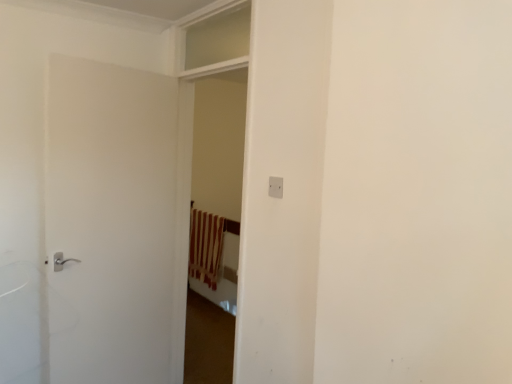
Question: Considering the relative sizes of white matte door at left and brown striped curtain at center in the image provided, is white matte door at left bigger than brown striped curtain at center?

Choices:
 (A) no
 (B) yes

Answer: (B)

Question: Is white matte door at left taller than brown striped curtain at center?

Choices:
 (A) yes
 (B) no

Answer: (A)

Question: Considering the relative positions of white matte door at left and brown striped curtain at center in the image provided, is white matte door at left to the left of brown striped curtain at center from the viewer's perspective?

Choices:
 (A) no
 (B) yes

Answer: (B)

Question: Does white matte door at left appear on the right side of brown striped curtain at center?

Choices:
 (A) no
 (B) yes

Answer: (A)

Question: Can you confirm if white matte door at left is thinner than brown striped curtain at center?

Choices:
 (A) no
 (B) yes

Answer: (B)

Question: In terms of height, does white plastic electric outlet at center look taller or shorter compared to brown striped curtain at center?

Choices:
 (A) short
 (B) tall

Answer: (A)

Question: Is white plastic electric outlet at center situated inside brown striped curtain at center or outside?

Choices:
 (A) inside
 (B) outside

Answer: (B)

Question: Is white plastic electric outlet at center wider or thinner than brown striped curtain at center?

Choices:
 (A) thin
 (B) wide

Answer: (A)

Question: Visually, is white plastic electric outlet at center positioned to the left or to the right of brown striped curtain at center?

Choices:
 (A) left
 (B) right

Answer: (B)

Question: Considering the positions of clear glass window at upper center and white matte door at left in the image, is clear glass window at upper center taller or shorter than white matte door at left?

Choices:
 (A) tall
 (B) short

Answer: (B)

Question: From the image's perspective, relative to white matte door at left, is clear glass window at upper center above or below?

Choices:
 (A) above
 (B) below

Answer: (A)

Question: From a real-world perspective, relative to white matte door at left, is clear glass window at upper center vertically above or below?

Choices:
 (A) above
 (B) below

Answer: (A)

Question: Is point (217, 16) closer or farther from the camera than point (155, 231)?

Choices:
 (A) closer
 (B) farther

Answer: (A)

Question: Does point (206, 258) appear closer or farther from the camera than point (205, 59)?

Choices:
 (A) farther
 (B) closer

Answer: (A)

Question: Based on their positions, is brown striped curtain at center located to the left or right of clear glass window at upper center?

Choices:
 (A) right
 (B) left

Answer: (B)